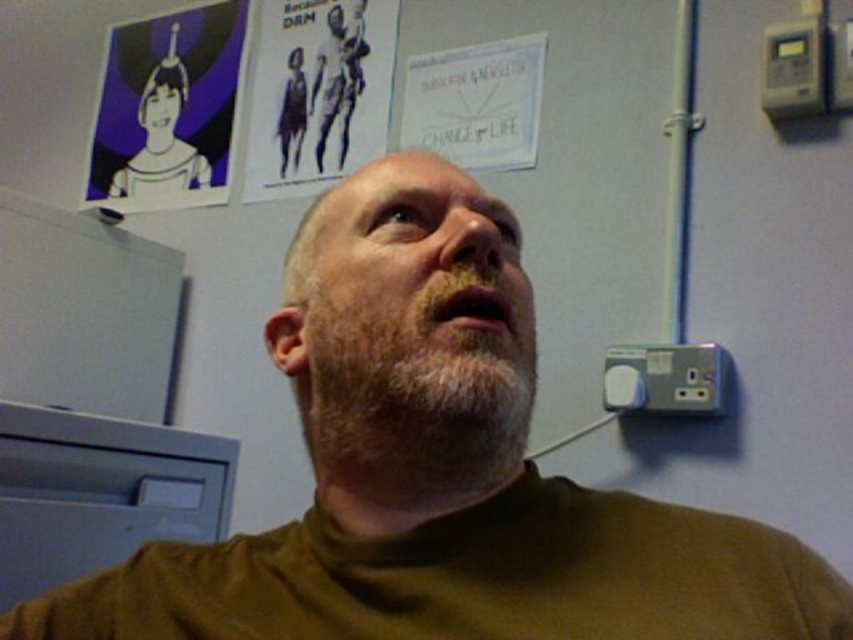
You are standing in front of the wall with posters. There is a point at coordinates (178, 115). What is located at that point?

The point at coordinates (178, 115) corresponds to the purple paper at upper left.

From the picture: You are standing in front of the wall with posters. There are two points marked on the wall at coordinates point (363, 387) and point (384, 60). Which point is closer to you?

Point (363, 387) is closer to the viewer than point (384, 60).